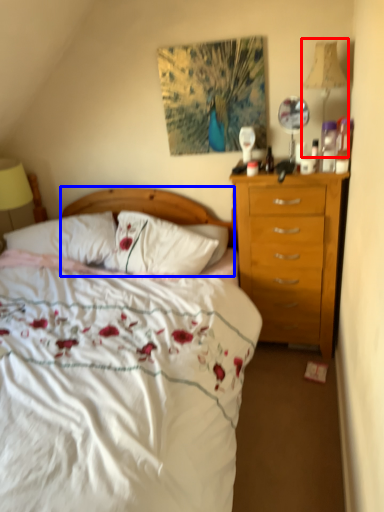
Question: Which point is closer to the camera, bedside lamp (highlighted by a red box) or headboard (highlighted by a blue box)?

Choices:
 (A) bedside lamp
 (B) headboard

Answer: (A)